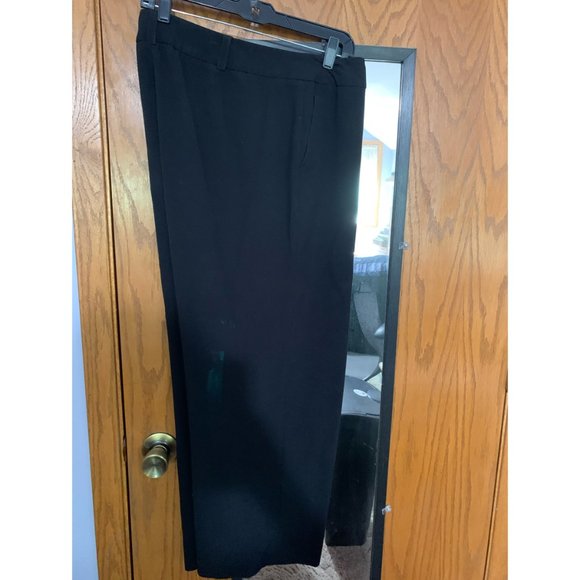
Where is `doorknob`? doorknob is located at coordinates (160, 472).